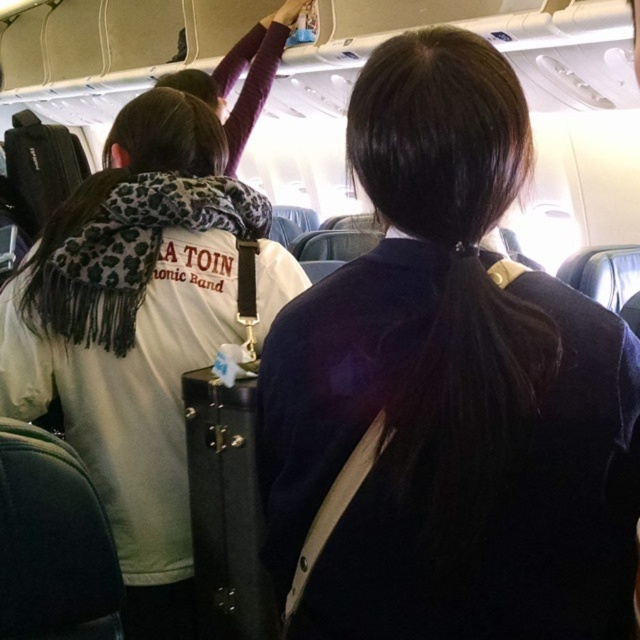
Question: Which object is closer to the camera taking this photo?

Choices:
 (A) white fleece jacket at upper left
 (B) dark blue fabric at center

Answer: (B)

Question: Which point is farther to the camera?

Choices:
 (A) dark blue fabric at center
 (B) white fleece jacket at upper left

Answer: (B)

Question: Considering the relative positions of dark blue fabric at center and white fleece jacket at upper left in the image provided, where is dark blue fabric at center located with respect to white fleece jacket at upper left?

Choices:
 (A) above
 (B) below

Answer: (A)

Question: Which object is closer to the camera taking this photo?

Choices:
 (A) white fleece jacket at upper left
 (B) dark blue fabric at center

Answer: (B)

Question: Can you confirm if dark blue fabric at center is positioned above white fleece jacket at upper left?

Choices:
 (A) yes
 (B) no

Answer: (A)

Question: Is dark blue fabric at center to the left of white fleece jacket at upper left from the viewer's perspective?

Choices:
 (A) yes
 (B) no

Answer: (B)